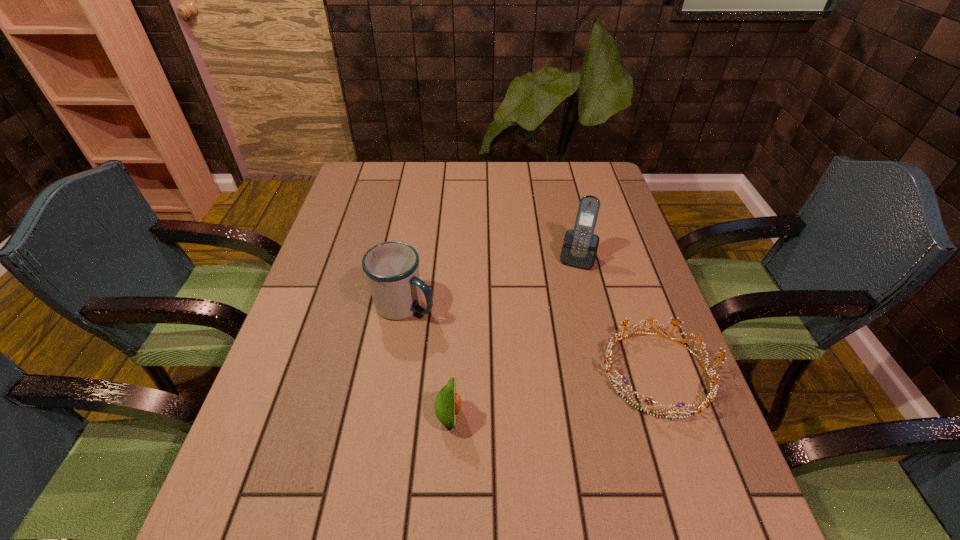
The width and height of the screenshot is (960, 540). Identify the location of free space between the mug and the cellular telephone. (491, 282).

Locate an element on the screen. This screenshot has height=540, width=960. free area in between the second farthest object and the tiara is located at coordinates pos(531,339).

Where is `vacant area that lies between the farthest object and the third tallest object`? The image size is (960, 540). vacant area that lies between the farthest object and the third tallest object is located at coordinates (513, 338).

This screenshot has width=960, height=540. What are the coordinates of `vacant point located between the tiara and the second farthest object` in the screenshot? It's located at (531, 339).

Where is `vacant space that's between the third nearest object and the farthest object`? The image size is (960, 540). vacant space that's between the third nearest object and the farthest object is located at coordinates (491, 282).

You are a GUI agent. You are given a task and a screenshot of the screen. Output one action in this format:
    pyautogui.click(x=<x>, y=<y>)
    Task: Click on the vacant area that lies between the leftmost object and the tiara
    The image size is (960, 540).
    Given the screenshot: What is the action you would take?
    pyautogui.click(x=531, y=339)

The height and width of the screenshot is (540, 960). I want to click on free space between the third object from right to left and the leftmost object, so click(426, 361).

You are a GUI agent. You are given a task and a screenshot of the screen. Output one action in this format:
    pyautogui.click(x=<x>, y=<y>)
    Task: Click on the vacant point located between the tiara and the second farthest object
    
    Given the screenshot: What is the action you would take?
    pyautogui.click(x=531, y=339)

I want to click on vacant space in between the farthest object and the second farthest object, so click(491, 282).

Where is `vacant space that's between the avocado and the farthest object`? vacant space that's between the avocado and the farthest object is located at coordinates (513, 338).